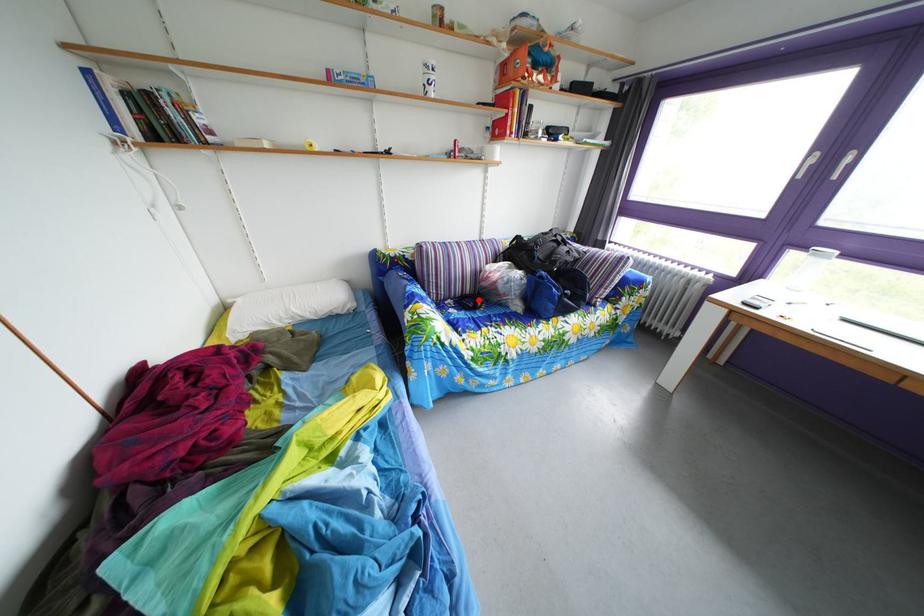
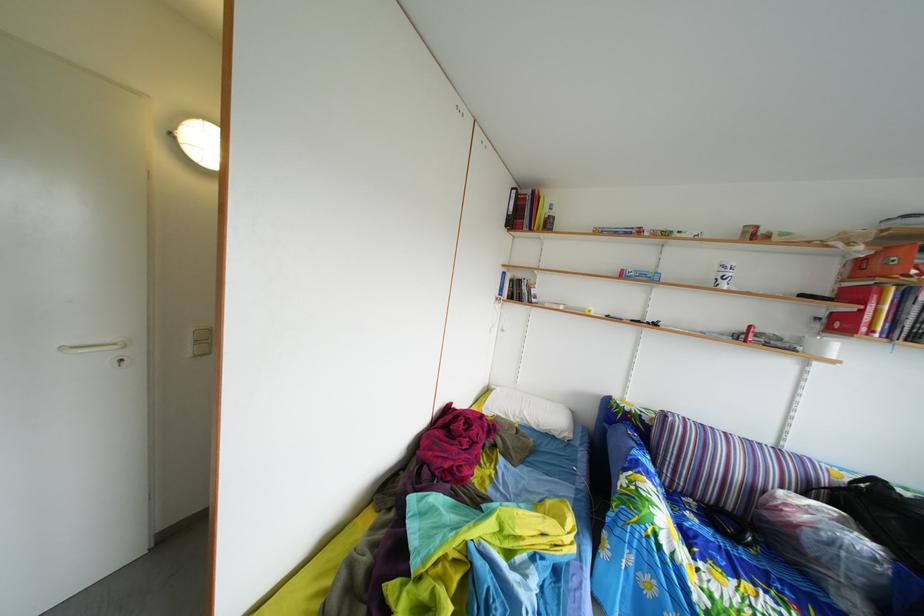
In the second image, find the point that corresponds to the highlighted location in the first image.

(739, 516)